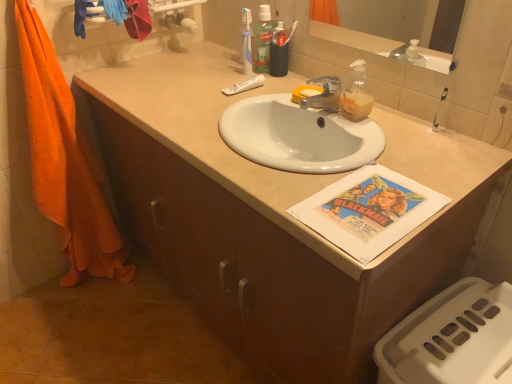
Find the location of a particular element. The width and height of the screenshot is (512, 384). vacant space to the right of orange cotton towel at left is located at coordinates (148, 288).